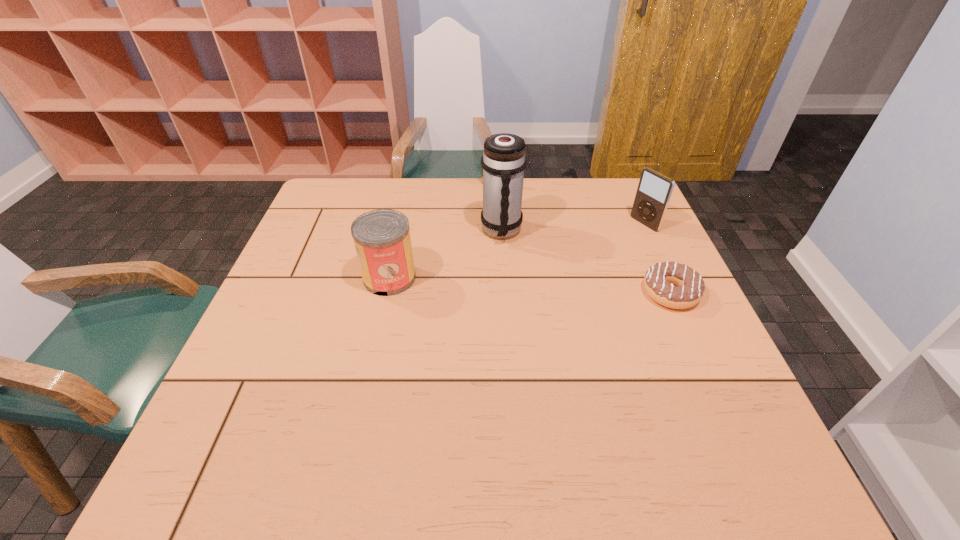
Find the location of a particular element. This screenshot has height=540, width=960. can is located at coordinates (381, 237).

What are the coordinates of `the shortest object` in the screenshot? It's located at (690, 288).

The height and width of the screenshot is (540, 960). I want to click on thermos bottle, so click(503, 161).

Image resolution: width=960 pixels, height=540 pixels. Identify the location of iPod. point(654,191).

You are a GUI agent. You are given a task and a screenshot of the screen. Output one action in this format:
    pyautogui.click(x=<x>, y=<y>)
    Task: Click on the padlock
    
    Given the screenshot: What is the action you would take?
    pyautogui.click(x=482, y=168)

I want to click on the farthest object, so click(482, 168).

The image size is (960, 540). What are the coordinates of `free location located 0.120m on the left of the leftmost object` in the screenshot? It's located at (317, 278).

You are a GUI agent. You are given a task and a screenshot of the screen. Output one action in this format:
    pyautogui.click(x=<x>, y=<y>)
    Task: Click on the free space located on the back of the shortest object
    
    Given the screenshot: What is the action you would take?
    pyautogui.click(x=652, y=252)

Find the location of a particular element. The image size is (960, 540). vacant space positioned on the side with the handle of the tallest object is located at coordinates (520, 277).

Locate an element on the screen. The height and width of the screenshot is (540, 960). free spot located on the side with the handle of the tallest object is located at coordinates (514, 260).